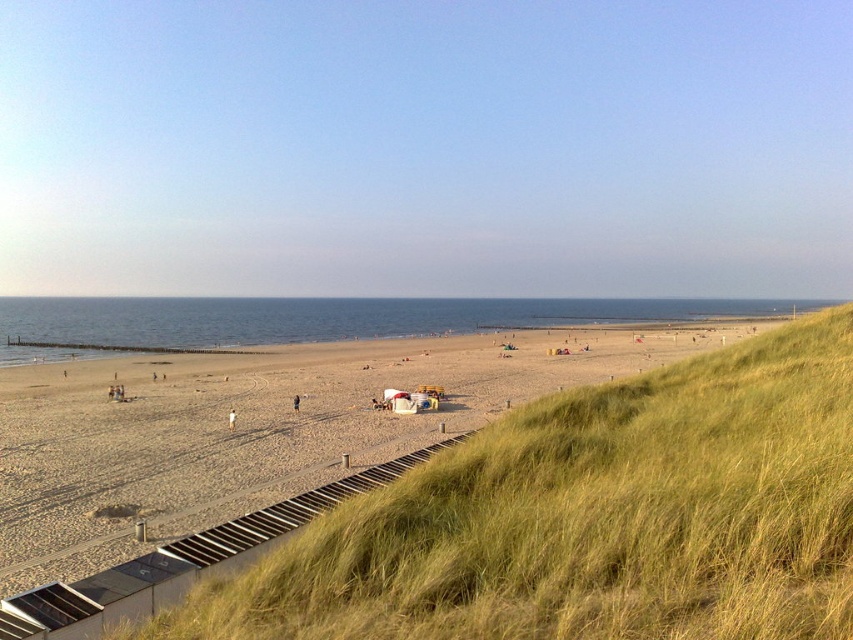
Question: Which point appears farthest from the camera in this image?

Choices:
 (A) (294, 404)
 (B) (231, 417)
 (C) (177, 465)

Answer: (A)

Question: Is beige sand beach at center above brown fabric person at center?

Choices:
 (A) no
 (B) yes

Answer: (B)

Question: Which object appears closest to the camera in this image?

Choices:
 (A) light brown sand at center
 (B) beige sand beach at center
 (C) brown fabric person at center

Answer: (B)

Question: Is beige sand beach at center positioned in front of brown fabric person at center?

Choices:
 (A) no
 (B) yes

Answer: (B)

Question: Which object is closer to the camera taking this photo?

Choices:
 (A) light brown sand at center
 (B) brown fabric person at center

Answer: (A)

Question: Does light brown sand at center appear on the right side of brown fabric person at center?

Choices:
 (A) yes
 (B) no

Answer: (B)